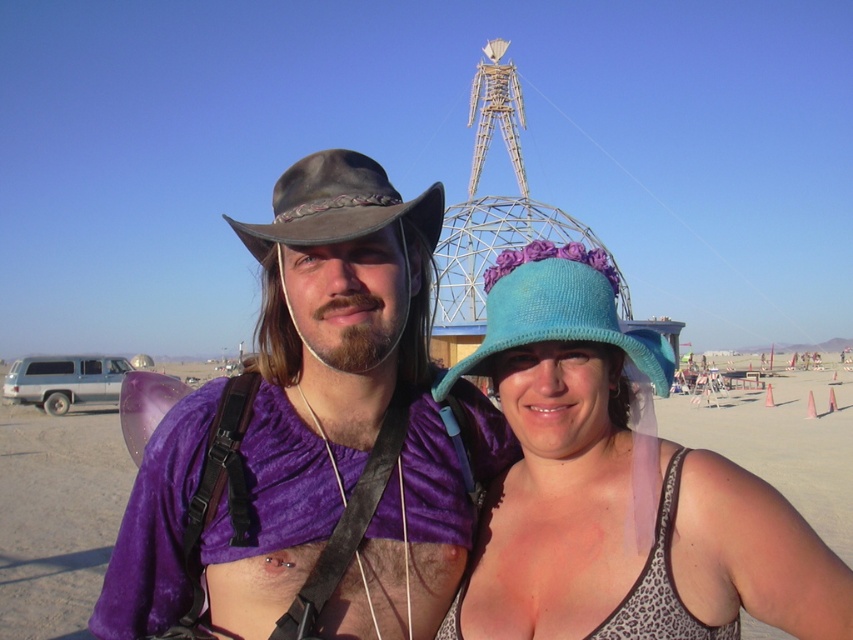
Question: Considering the relative positions of velvet purple shirt at center and brown felt cowboy hat at center in the image provided, where is velvet purple shirt at center located with respect to brown felt cowboy hat at center?

Choices:
 (A) above
 (B) below

Answer: (B)

Question: Does velvet purple shirt at center lie behind brown felt cowboy hat at center?

Choices:
 (A) yes
 (B) no

Answer: (B)

Question: Which object appears closest to the camera in this image?

Choices:
 (A) velvet purple shirt at center
 (B) blue knitted hat at center

Answer: (B)

Question: Which point appears farthest from the camera in this image?

Choices:
 (A) (347, 225)
 (B) (788, 538)
 (C) (235, 625)

Answer: (A)

Question: Which point is farther to the camera?

Choices:
 (A) blue knitted hat at center
 (B) velvet purple shirt at center

Answer: (B)

Question: Does purple fabric at center appear on the right side of brown felt cowboy hat at center?

Choices:
 (A) no
 (B) yes

Answer: (B)